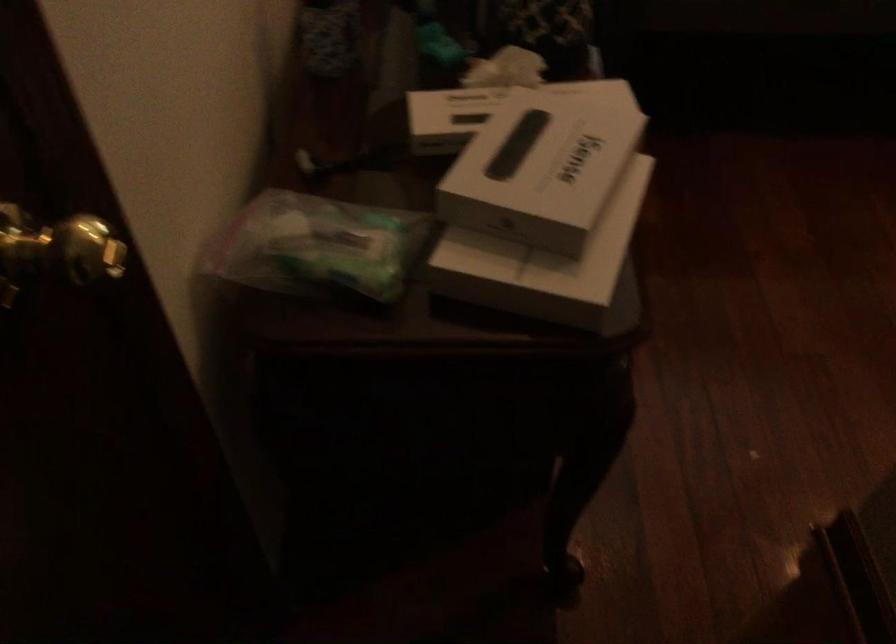
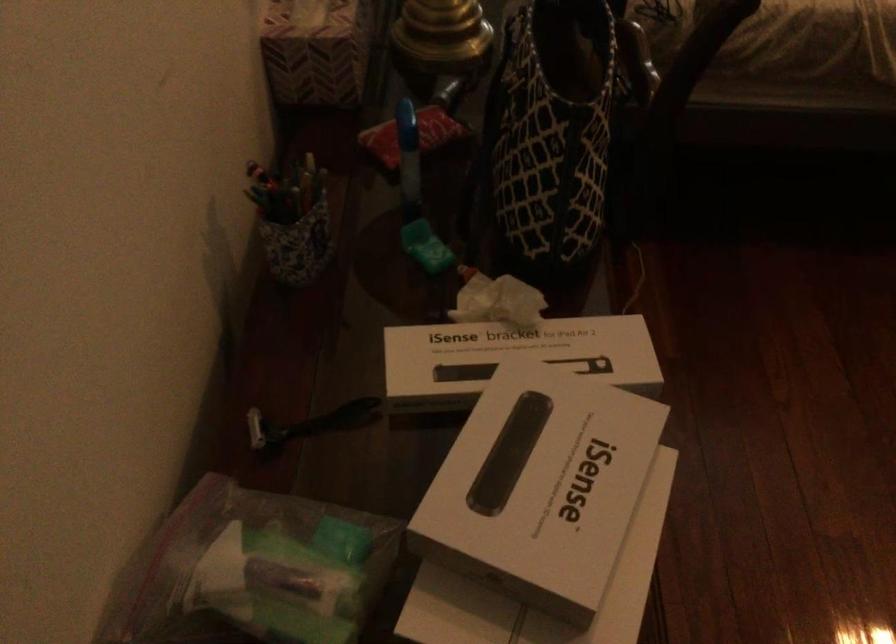
Find the pixel in the second image that matches point 313,228 in the first image.

(252, 571)